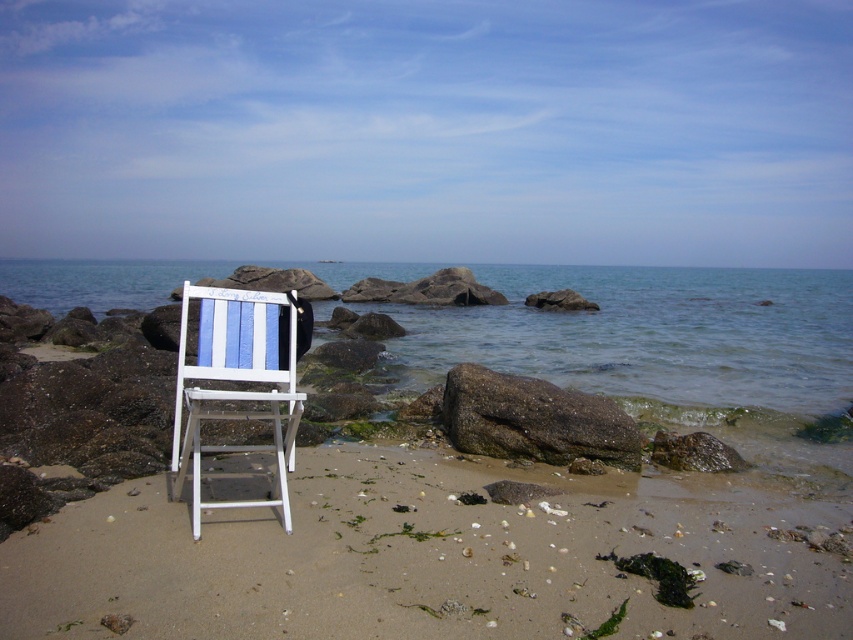
Question: Which of the following is the farthest from the observer?

Choices:
 (A) (178, 348)
 (B) (312, 460)
 (C) (622, 413)

Answer: (A)

Question: Considering the real-world distances, which object is closest to the white wood chair at center?

Choices:
 (A) sandy brown at lower center
 (B) rusty metallic rock at center

Answer: (A)

Question: Which point is farther to the camera?

Choices:
 (A) (177, 595)
 (B) (512, 428)
 (C) (184, 358)

Answer: (B)

Question: Can you confirm if sandy brown at lower center is thinner than white wood chair at center?

Choices:
 (A) no
 (B) yes

Answer: (A)

Question: Is sandy brown at lower center to the right of rusty metallic rock at center from the viewer's perspective?

Choices:
 (A) yes
 (B) no

Answer: (A)

Question: Does sandy brown at lower center appear on the right side of rusty metallic rock at center?

Choices:
 (A) no
 (B) yes

Answer: (B)